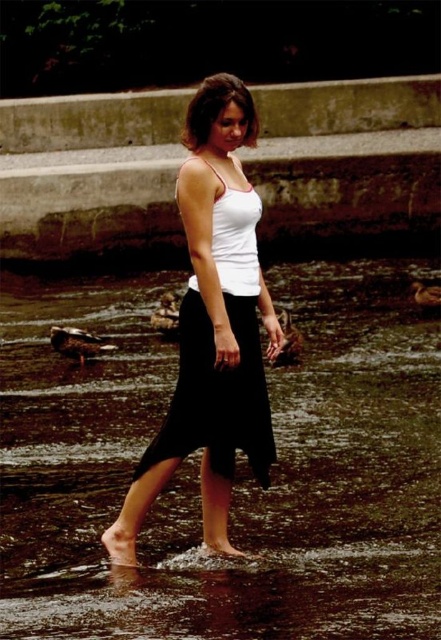
Question: Among these points, which one is farthest from the camera?

Choices:
 (A) (235, 532)
 (B) (269, 305)

Answer: (B)

Question: Which of the following is the closest to the observer?

Choices:
 (A) (11, 280)
 (B) (179, 344)

Answer: (B)

Question: Is clear water at center bigger than white matte tank top at center?

Choices:
 (A) yes
 (B) no

Answer: (A)

Question: Can you confirm if clear water at center is positioned above white matte tank top at center?

Choices:
 (A) yes
 (B) no

Answer: (B)

Question: Does clear water at center appear on the right side of white matte tank top at center?

Choices:
 (A) no
 (B) yes

Answer: (B)